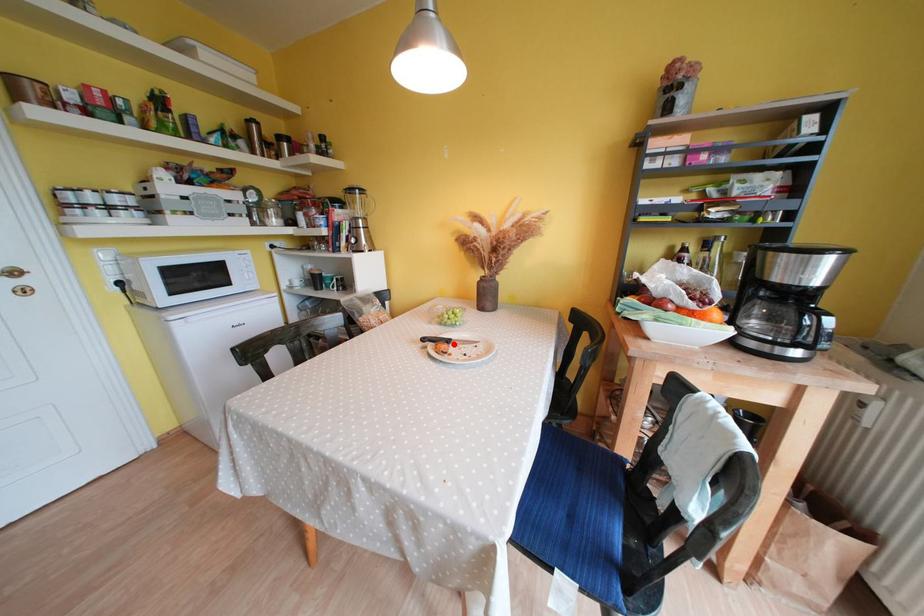
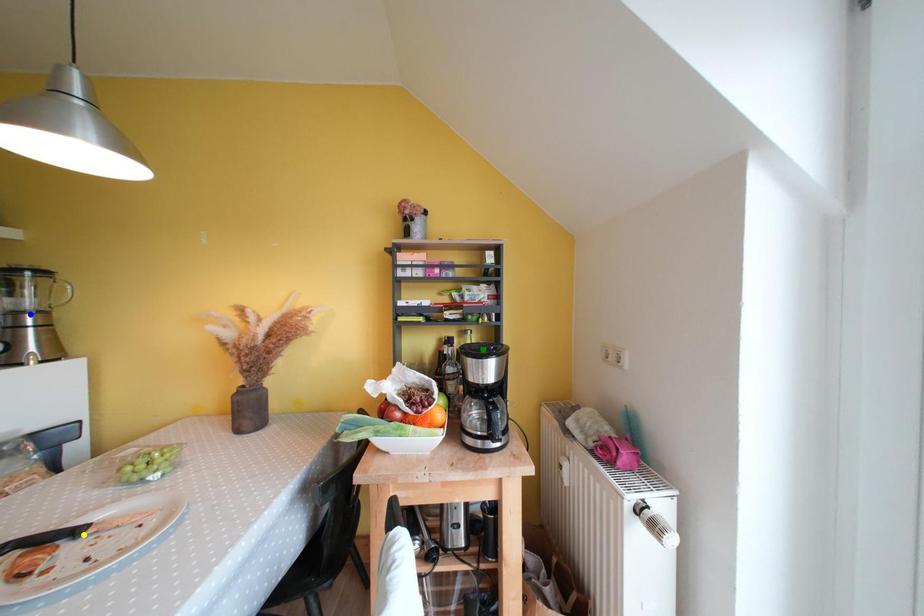
Question: I am providing you with two images of the same scene from different viewpoints. A red point is marked on the first image. You are given multiple points on the second image. Can you choose the point in image 2 that corresponds to the point in image 1?

Choices:
 (A) green point
 (B) yellow point
 (C) blue point

Answer: (B)